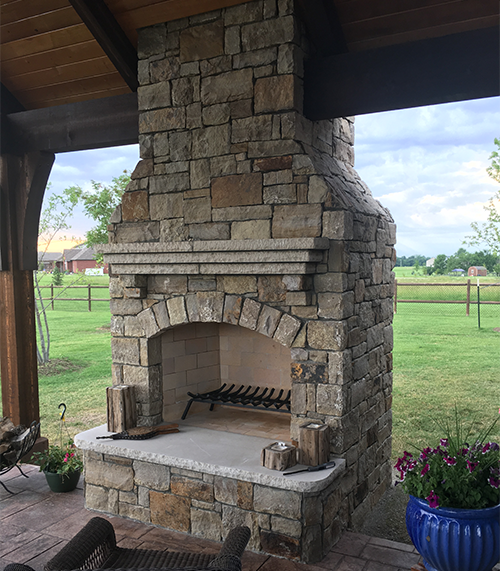
At what (x,y) coordinates should I click in order to perform the action: click on black metal rack. Please return your answer as a coordinate pair (x, y). Looking at the image, I should click on (253, 399).